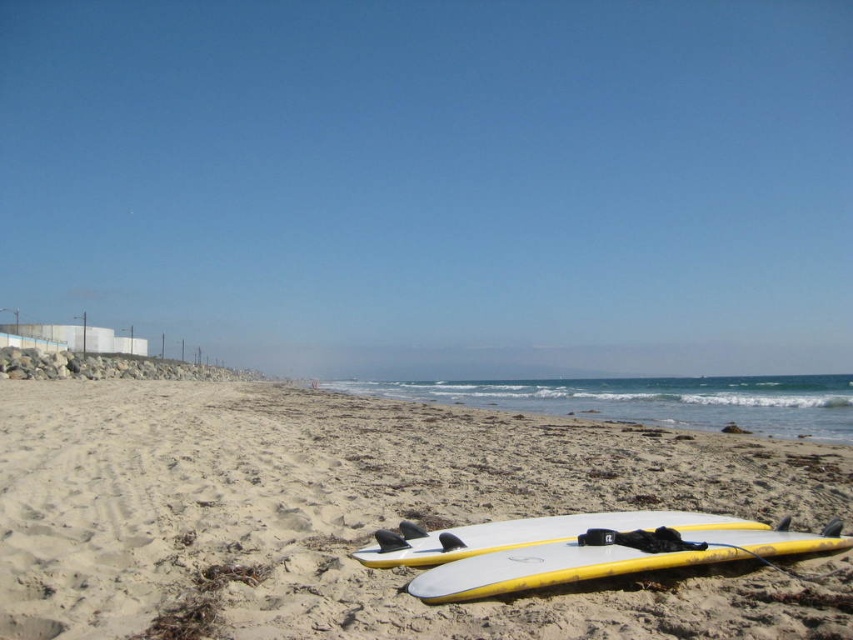
You are a lifeguard standing at the center of the beach. You need to quickly locate the yellow matte surfboard at lower center. According to the coordinates provided, in which direction should you look from your current position?

The yellow matte surfboard at lower center is located at coordinates point (613, 557), which means you should look towards the lower center direction from your current position as a lifeguard standing at the center of the beach.